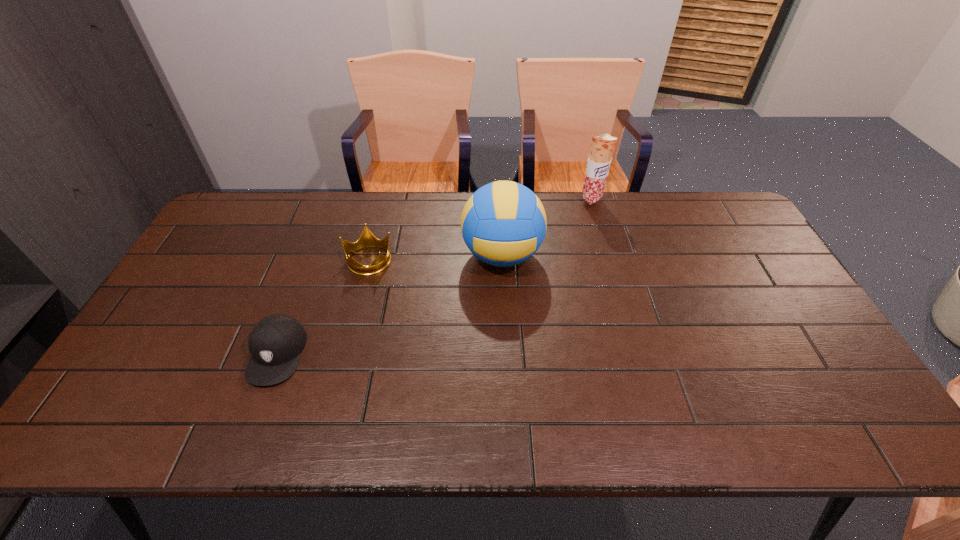
You are a GUI agent. You are given a task and a screenshot of the screen. Output one action in this format:
    pyautogui.click(x=<x>, y=<y>)
    Task: Click on the burrito at the far edge
    Image resolution: width=960 pixels, height=540 pixels.
    Given the screenshot: What is the action you would take?
    pyautogui.click(x=602, y=147)

Where is `volleyball that is at the far edge`? volleyball that is at the far edge is located at coordinates (503, 223).

Locate an element on the screen. The width and height of the screenshot is (960, 540). vacant area at the far edge is located at coordinates (558, 218).

This screenshot has height=540, width=960. I want to click on free space at the near edge of the desktop, so click(285, 421).

The image size is (960, 540). In order to click on blank space at the left edge in this screenshot , I will do `click(206, 246)`.

In the image, there is a desktop. At what (x,y) coordinates should I click in order to perform the action: click on vacant space at the right edge. Please return your answer as a coordinate pair (x, y). This screenshot has height=540, width=960. Looking at the image, I should click on (768, 355).

Find the location of a particular element. vacant space at the far right corner of the desktop is located at coordinates (708, 207).

In the image, there is a desktop. Find the location of `free space at the near right corner`. free space at the near right corner is located at coordinates (839, 420).

The width and height of the screenshot is (960, 540). I want to click on vacant space that's between the volleyball and the crown, so click(435, 258).

Where is `free area in between the farthest object and the cap`? free area in between the farthest object and the cap is located at coordinates (434, 276).